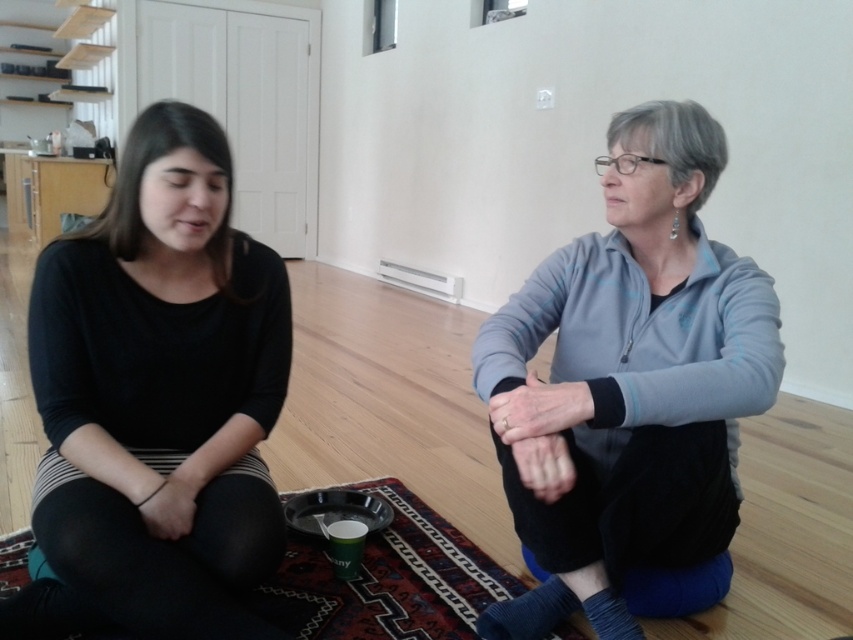
You are a delivery robot with a package that needs to be placed between the black matte shirt at left and the gray fleece jacket at center. The package is 24 inches long. Can you fit the package between them without overlapping either item?

The black matte shirt at left and gray fleece jacket at center are 26.24 inches apart. Since the package is 24 inches long, it can fit between them as there is enough space.

You are standing at the origin of the coordinate system. You see a gray fleece jacket at center. Where is the point located at coordinate (628, 380)?

The point located at coordinate (628, 380) is on the gray fleece jacket at center.

You are trying to place a gray fleece jacket at center on a carpeted mat at center. Based on the scene description, will the jacket be entirely on the mat?

The gray fleece jacket at center is to the right of the carpeted mat at center, so part of the jacket may hang off the edge of the mat unless it is centered precisely.